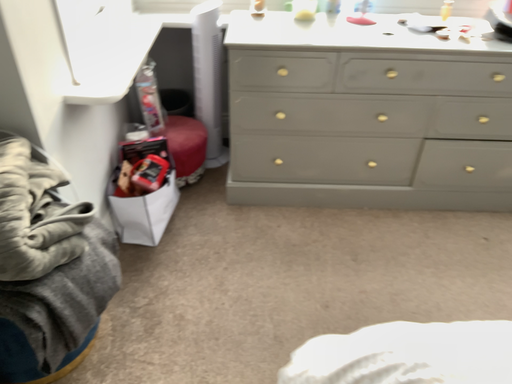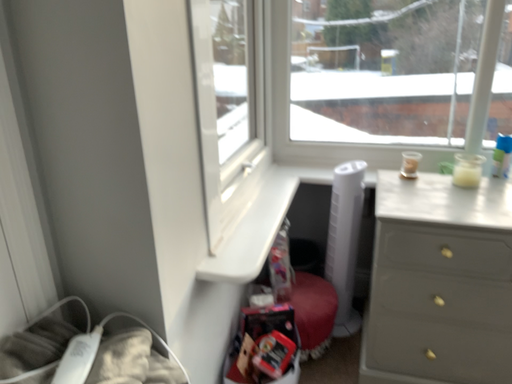
Question: Which way did the camera rotate in the video?

Choices:
 (A) rotated left
 (B) rotated right

Answer: (A)